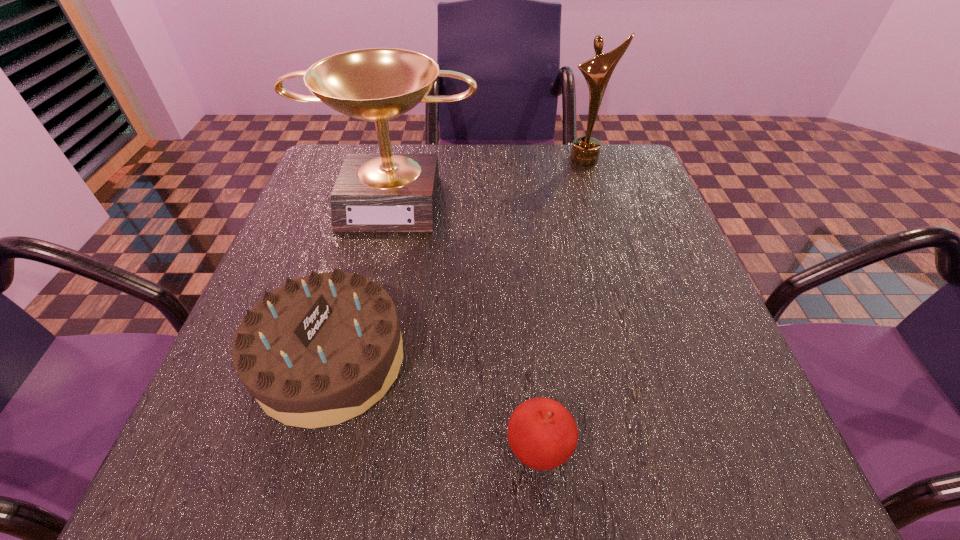
Locate an element on the screen. apple present at the near edge is located at coordinates (542, 434).

Locate an element on the screen. award that is at the left edge is located at coordinates (386, 192).

Identify the location of birthday cake that is at the left edge. The image size is (960, 540). (319, 350).

The height and width of the screenshot is (540, 960). Find the location of `object that is at the right edge`. object that is at the right edge is located at coordinates (597, 71).

This screenshot has height=540, width=960. I want to click on object that is at the far left corner, so click(x=386, y=192).

Identify the location of object situated at the near left corner. (319, 350).

Find the location of a particular element. object positioned at the far right corner is located at coordinates (597, 71).

This screenshot has width=960, height=540. In the image, there is a desktop. Find the location of `vacant space at the far edge`. vacant space at the far edge is located at coordinates (502, 162).

Find the location of a particular element. vacant space at the near edge is located at coordinates (499, 433).

Identify the location of vacant point at the left edge. This screenshot has height=540, width=960. (226, 356).